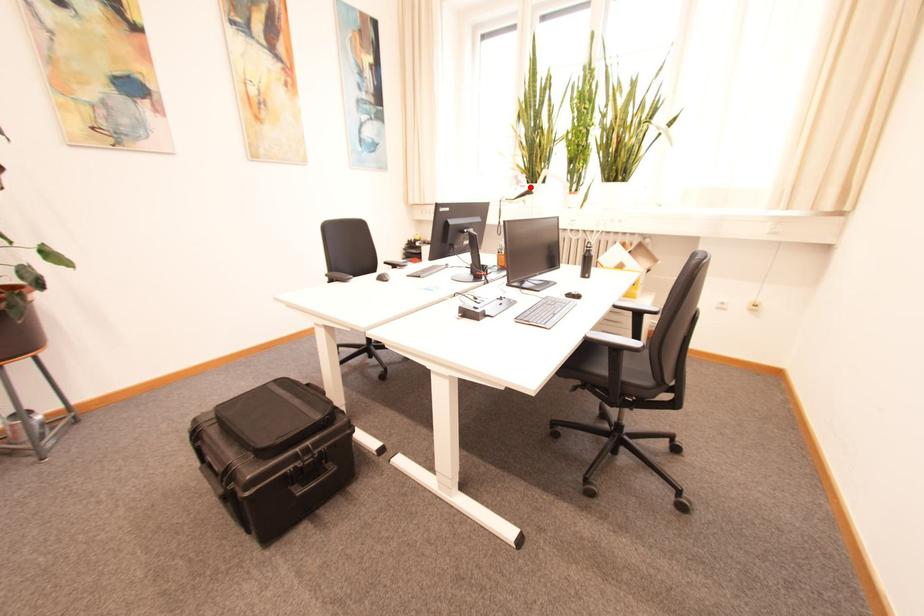
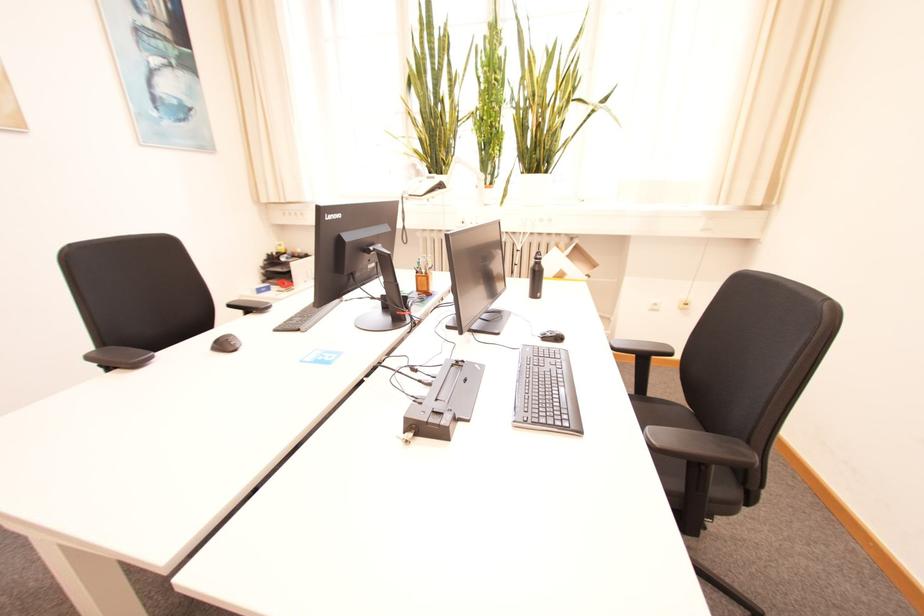
Find the pixel in the second image that matches the highlighted location in the first image.

(440, 177)